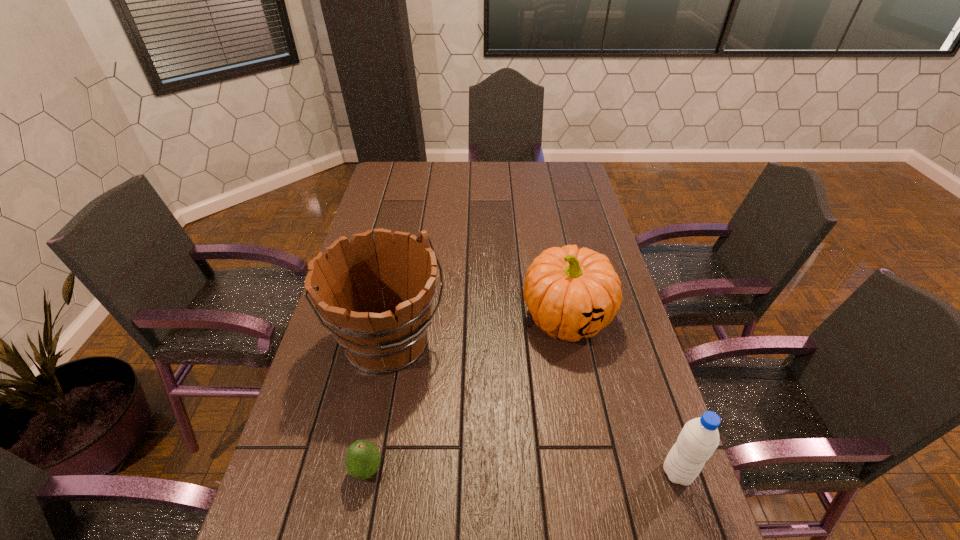
Where is `free region located 0.080m on the surface of the second object from right to left`? free region located 0.080m on the surface of the second object from right to left is located at coordinates (538, 372).

Where is `blank space located on the surface of the second object from right to left`? blank space located on the surface of the second object from right to left is located at coordinates (498, 443).

Where is `avocado positioned at the left edge`? This screenshot has height=540, width=960. avocado positioned at the left edge is located at coordinates (362, 460).

Where is `wine bucket located in the left edge section of the desktop`? wine bucket located in the left edge section of the desktop is located at coordinates (344, 283).

Locate an element on the screen. water bottle present at the right edge is located at coordinates (699, 438).

Find the location of a particular element. pumpkin that is at the right edge is located at coordinates (571, 293).

The width and height of the screenshot is (960, 540). What are the coordinates of `vacant space at the far edge of the desktop` in the screenshot? It's located at (448, 168).

Locate an element on the screen. This screenshot has height=540, width=960. free point at the left edge is located at coordinates (359, 431).

At what (x,y) coordinates should I click in order to perform the action: click on vacant point at the right edge. Please return your answer as a coordinate pair (x, y). The width and height of the screenshot is (960, 540). Looking at the image, I should click on (640, 413).

This screenshot has height=540, width=960. In order to click on blank space at the near right corner of the desktop in this screenshot , I will do `click(617, 507)`.